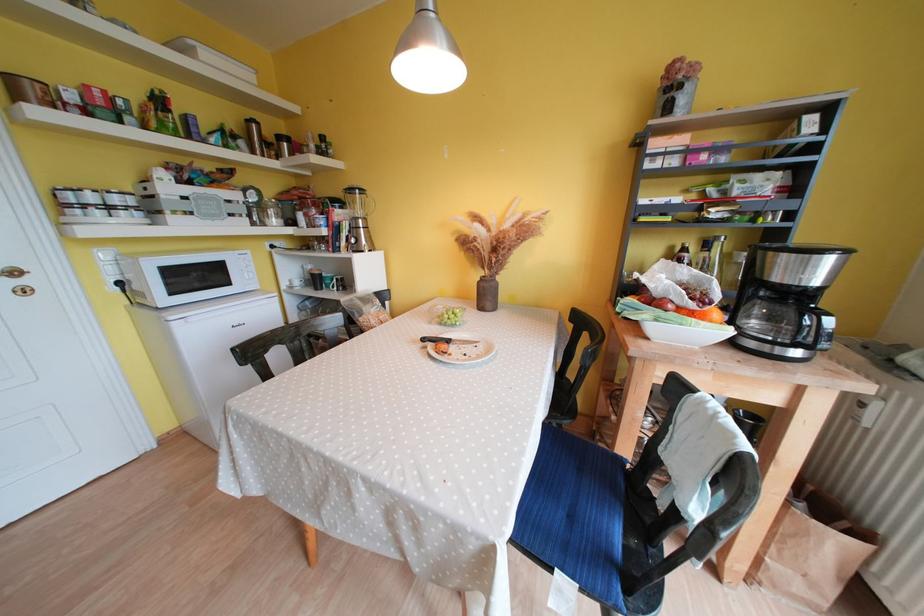
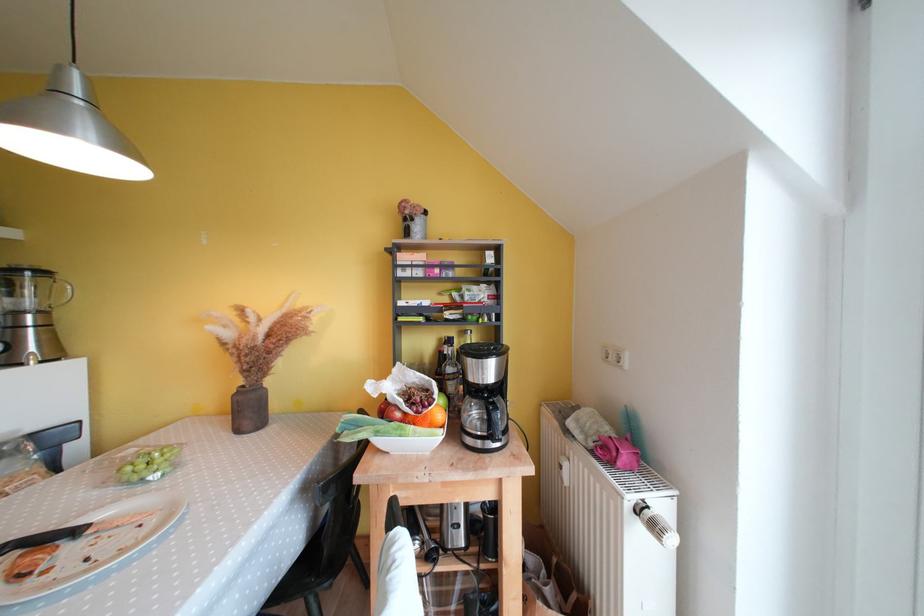
Where in the second image is the point corresponding to the point at 371,223 from the first image?

(49, 315)